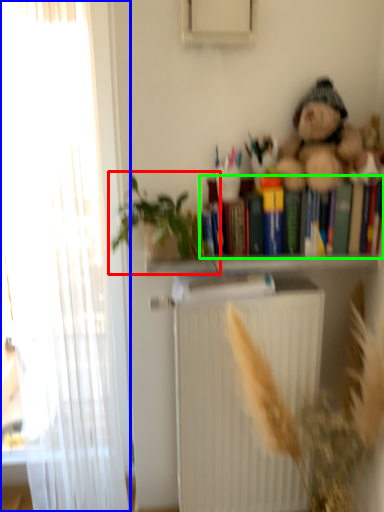
Question: Estimate the real-world distances between objects in this image. Which object is closer to houseplant (highlighted by a red box), curtain (highlighted by a blue box) or book (highlighted by a green box)?

Choices:
 (A) curtain
 (B) book

Answer: (A)